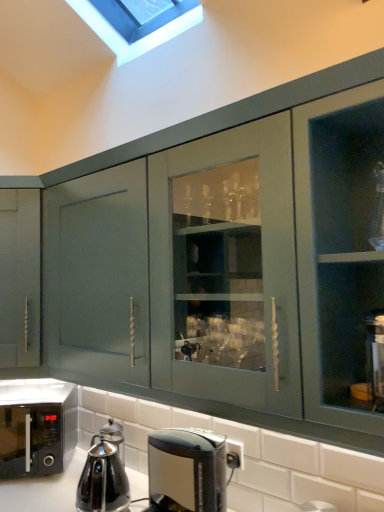
Question: Does black glossy microwave at lower left lie behind black glossy coffee maker at lower center?

Choices:
 (A) no
 (B) yes

Answer: (B)

Question: Does black glossy microwave at lower left come in front of black glossy coffee maker at lower center?

Choices:
 (A) yes
 (B) no

Answer: (B)

Question: Is black glossy microwave at lower left taller than black glossy coffee maker at lower center?

Choices:
 (A) yes
 (B) no

Answer: (A)

Question: Is black glossy coffee maker at lower center completely or partially inside black glossy microwave at lower left?

Choices:
 (A) no
 (B) yes

Answer: (A)

Question: Is black glossy microwave at lower left at the right side of black glossy coffee maker at lower center?

Choices:
 (A) no
 (B) yes

Answer: (A)

Question: Can you confirm if black glossy microwave at lower left is smaller than black glossy coffee maker at lower center?

Choices:
 (A) no
 (B) yes

Answer: (A)

Question: Does stainless steel kettle at lower left have a greater height compared to black glossy coffee maker at lower center?

Choices:
 (A) yes
 (B) no

Answer: (B)

Question: Are stainless steel kettle at lower left and black glossy coffee maker at lower center beside each other?

Choices:
 (A) no
 (B) yes

Answer: (A)

Question: From the image's perspective, is stainless steel kettle at lower left beneath black glossy coffee maker at lower center?

Choices:
 (A) no
 (B) yes

Answer: (B)

Question: Is stainless steel kettle at lower left located outside black glossy coffee maker at lower center?

Choices:
 (A) no
 (B) yes

Answer: (B)

Question: From the image's perspective, would you say stainless steel kettle at lower left is positioned over black glossy coffee maker at lower center?

Choices:
 (A) yes
 (B) no

Answer: (B)

Question: Can you confirm if stainless steel kettle at lower left is wider than black glossy coffee maker at lower center?

Choices:
 (A) no
 (B) yes

Answer: (A)

Question: Is black glossy microwave at lower left located within stainless steel kettle at lower left?

Choices:
 (A) no
 (B) yes

Answer: (A)